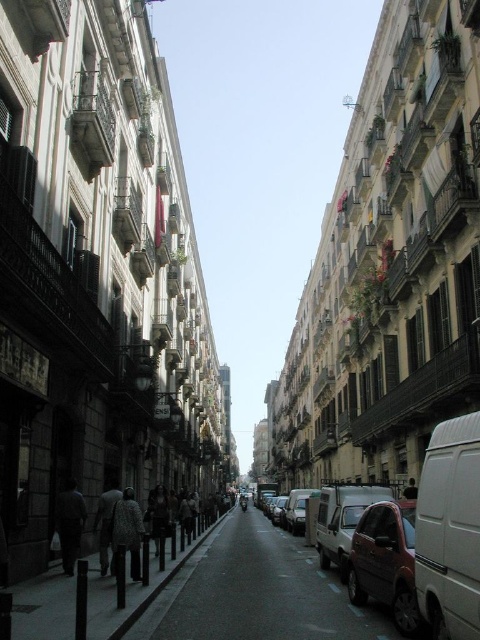
Question: Is the position of metallic red car at center less distant than that of matte white van at center?

Choices:
 (A) yes
 (B) no

Answer: (A)

Question: Is matte white van at center thinner than matte silver car at center?

Choices:
 (A) yes
 (B) no

Answer: (B)

Question: Considering the real-world distances, which object is closest to the metallic red car at center?

Choices:
 (A) matte silver car at center
 (B) dark asphalt road at center
 (C) matte white van at center

Answer: (C)

Question: Is dark asphalt road at center in front of metallic red car at center?

Choices:
 (A) yes
 (B) no

Answer: (B)

Question: Which object appears closest to the camera in this image?

Choices:
 (A) dark asphalt road at center
 (B) white matte van at center

Answer: (B)

Question: Which point is farther to the camera?

Choices:
 (A) metallic red car at center
 (B) matte silver car at center
 (C) white matte van at center
 (D) dark asphalt road at center

Answer: (B)